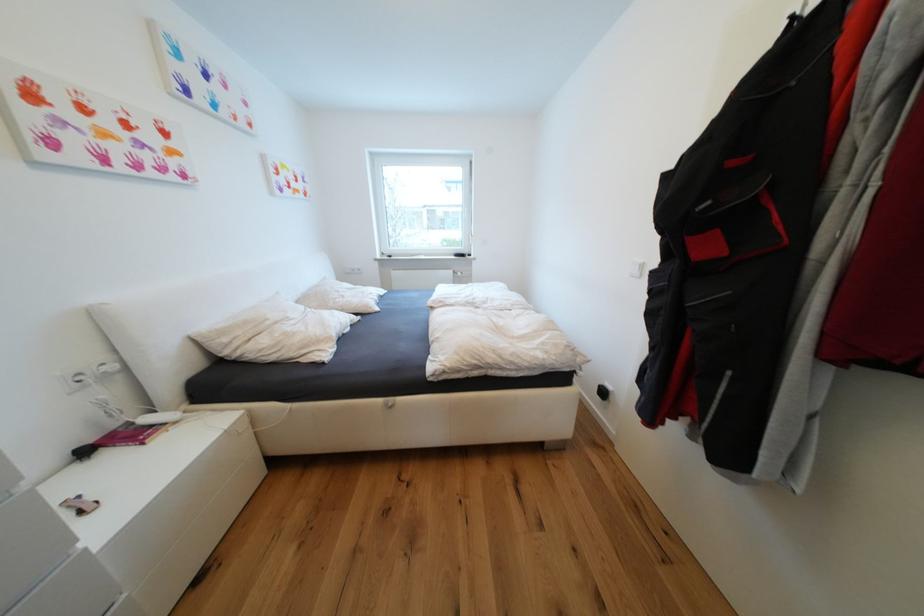
Find the location of a particular element. jacket pocket flap is located at coordinates (734, 220).